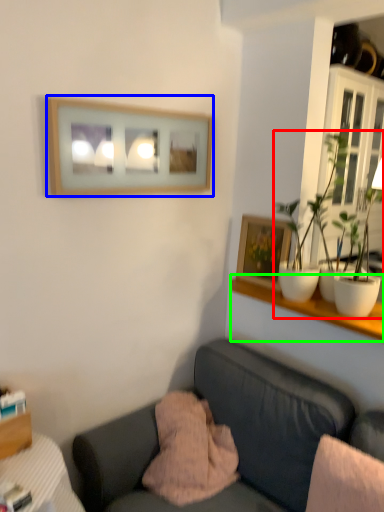
Question: Which object is positioned farthest from houseplant (highlighted by a red box)? Select from picture frame (highlighted by a blue box) and shelf (highlighted by a green box).

Choices:
 (A) picture frame
 (B) shelf

Answer: (A)